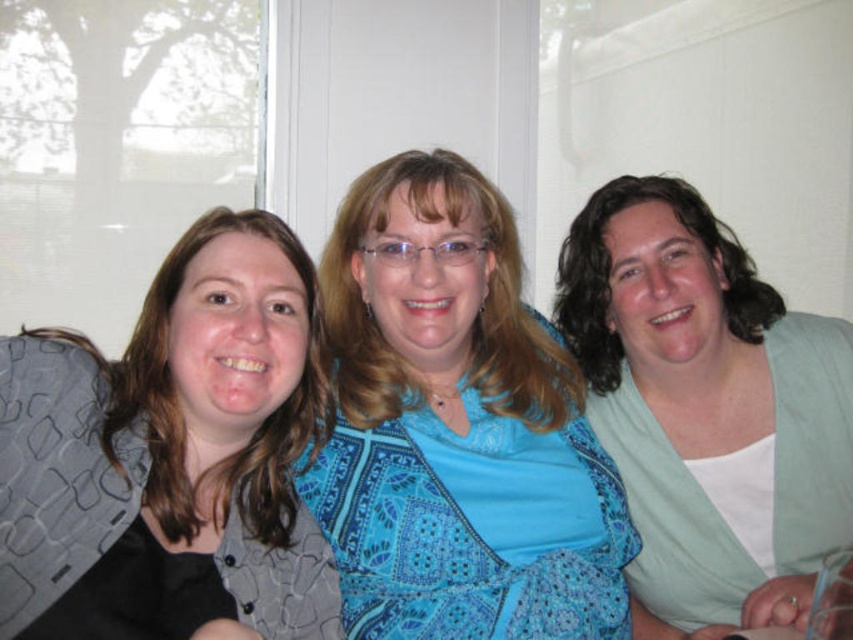
Which of these two, blue paisley dress at center or matte gray vest at left, stands shorter?

matte gray vest at left

Can you confirm if blue paisley dress at center is thinner than matte gray vest at left?

No.

What do you see at coordinates (453, 424) in the screenshot? This screenshot has height=640, width=853. I see `blue paisley dress at center` at bounding box center [453, 424].

This screenshot has width=853, height=640. Identify the location of blue paisley dress at center. (453, 424).

Is blue paisley dress at center bigger than white matte shirt at right?

Incorrect, blue paisley dress at center is not larger than white matte shirt at right.

Between point (616, 476) and point (694, 504), which one is positioned behind?

The point (694, 504) is behind.

You are a GUI agent. You are given a task and a screenshot of the screen. Output one action in this format:
    pyautogui.click(x=<x>, y=<y>)
    Task: Click on the blue paisley dress at center
    The image size is (853, 640).
    Given the screenshot: What is the action you would take?
    453,424

Is matte gray vest at left smaller than white matte shirt at right?

Yes.

Between point (271, 520) and point (762, 323), which one is positioned in front?

Point (271, 520) is in front.

Where is `matte gray vest at left`? matte gray vest at left is located at coordinates (170, 454).